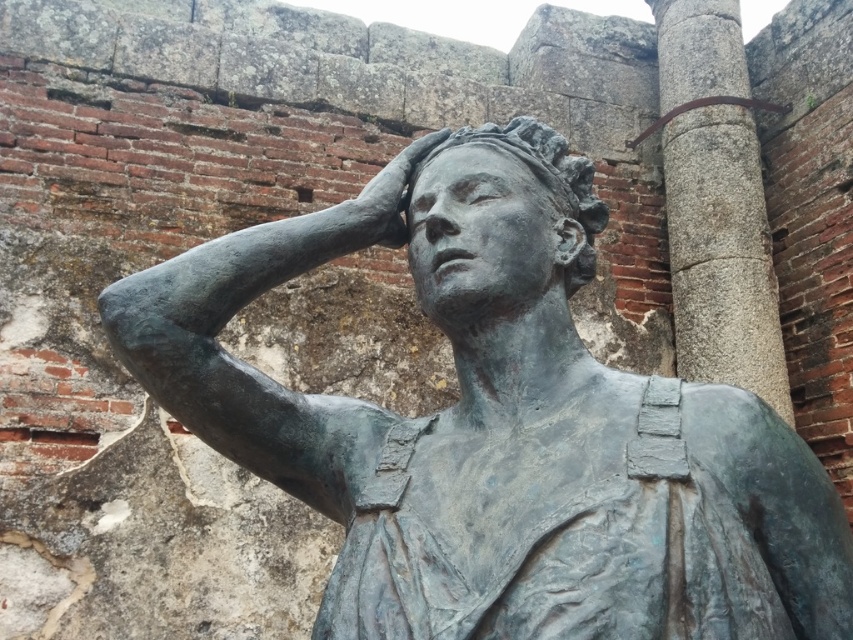
Can you confirm if bronze statue head at center is positioned to the right of bronze hand at center?

Yes, bronze statue head at center is to the right of bronze hand at center.

Does bronze statue head at center have a greater width compared to bronze hand at center?

Correct, the width of bronze statue head at center exceeds that of bronze hand at center.

You are a GUI agent. You are given a task and a screenshot of the screen. Output one action in this format:
    pyautogui.click(x=<x>, y=<y>)
    Task: Click on the bronze statue head at center
    This screenshot has width=853, height=640.
    Given the screenshot: What is the action you would take?
    pyautogui.click(x=543, y=177)

Is bronze statue at center positioned at the back of gray stone column at upper right?

No.

Is the position of bronze statue at center less distant than that of gray stone column at upper right?

Yes.

The width and height of the screenshot is (853, 640). Find the location of `bronze statue at center`. bronze statue at center is located at coordinates (503, 432).

This screenshot has height=640, width=853. In order to click on bronze statue at center in this screenshot , I will do `click(503, 432)`.

Who is taller, bronze statue at center or bronze hand at center?

Standing taller between the two is bronze statue at center.

Is bronze statue at center smaller than bronze hand at center?

Actually, bronze statue at center might be larger than bronze hand at center.

Locate an element on the screen. bronze statue at center is located at coordinates (503, 432).

Where is `bronze statue at center`? The image size is (853, 640). bronze statue at center is located at coordinates point(503,432).